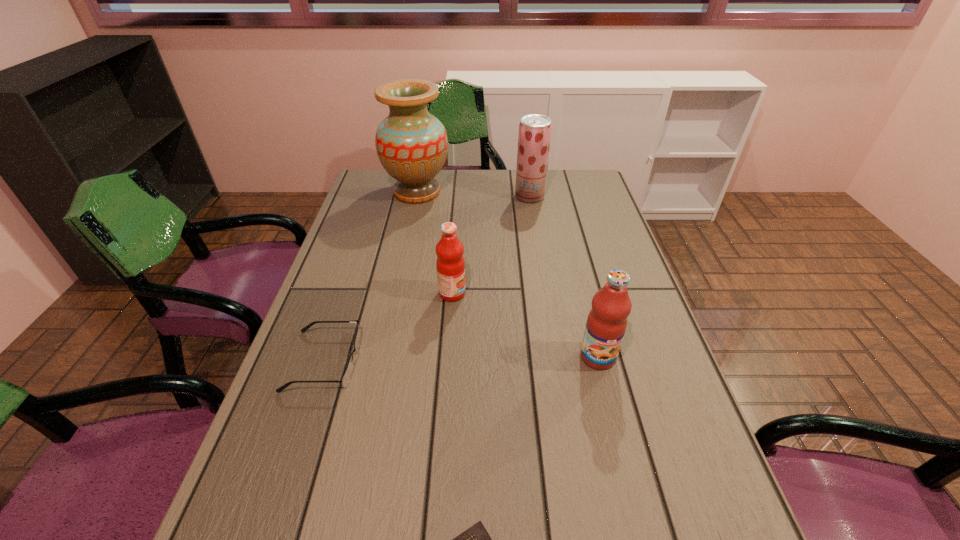
The width and height of the screenshot is (960, 540). What are the coordinates of `the tallest object` in the screenshot? It's located at (412, 145).

Where is `the second fruit juice from right to left`? This screenshot has height=540, width=960. the second fruit juice from right to left is located at coordinates (534, 136).

Find the location of a particular element. Image resolution: width=960 pixels, height=540 pixels. the second object from right to left is located at coordinates (534, 136).

What are the coordinates of `the rightmost object` in the screenshot? It's located at (606, 324).

You are a GUI agent. You are given a task and a screenshot of the screen. Output one action in this format:
    pyautogui.click(x=<x>, y=<y>)
    Task: Click on the nearest fruit juice
    
    Given the screenshot: What is the action you would take?
    pyautogui.click(x=606, y=324)

Identify the location of the third farthest object. This screenshot has width=960, height=540. (450, 264).

Identify the location of the second farthest fruit juice. The image size is (960, 540). (450, 264).

You are a GUI agent. You are given a task and a screenshot of the screen. Output one action in this format:
    pyautogui.click(x=<x>, y=<y>)
    Task: Click on the spectacles
    Image resolution: width=960 pixels, height=540 pixels.
    Given the screenshot: What is the action you would take?
    pyautogui.click(x=346, y=377)

Image resolution: width=960 pixels, height=540 pixels. Find the location of `vacant space positioned on the right of the tallest object`. vacant space positioned on the right of the tallest object is located at coordinates (547, 192).

Where is `vacant space located on the left of the fifth object from left to right`? Image resolution: width=960 pixels, height=540 pixels. vacant space located on the left of the fifth object from left to right is located at coordinates (417, 196).